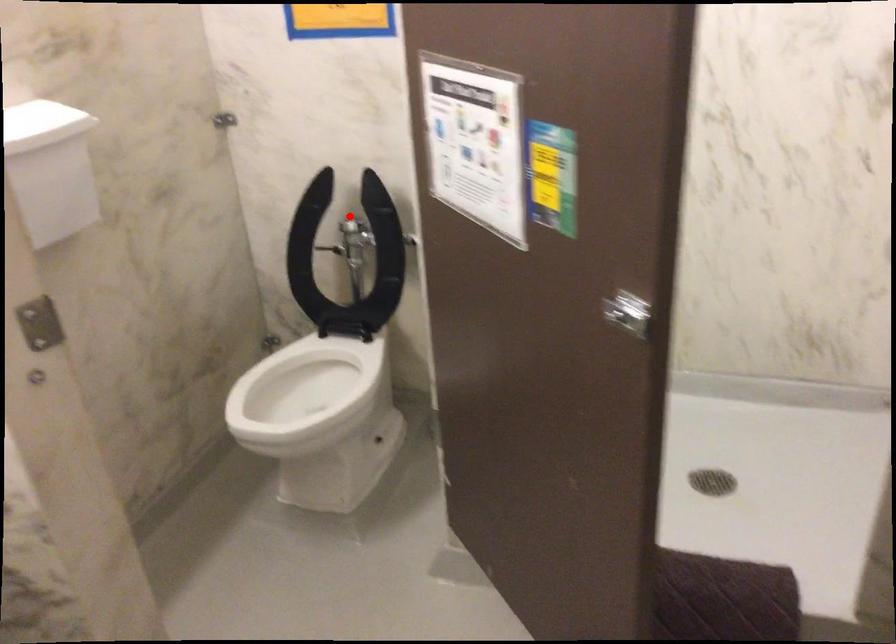
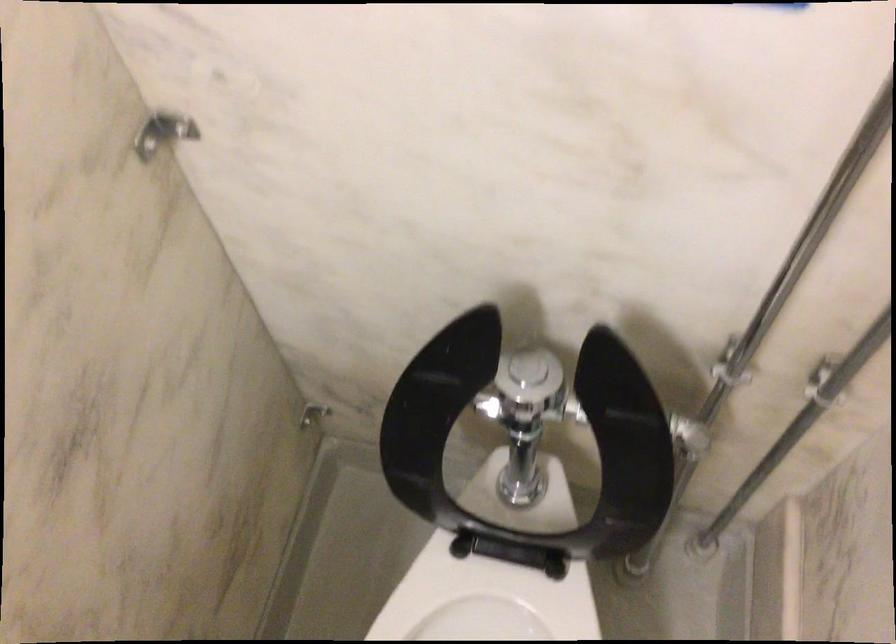
Question: I am providing you with two images of the same scene from different viewpoints. Given a red point in image1, look at the same physical point in image2. Is it:

Choices:
 (A) Closer to the viewpoint
 (B) Farther from the viewpoint

Answer: (A)